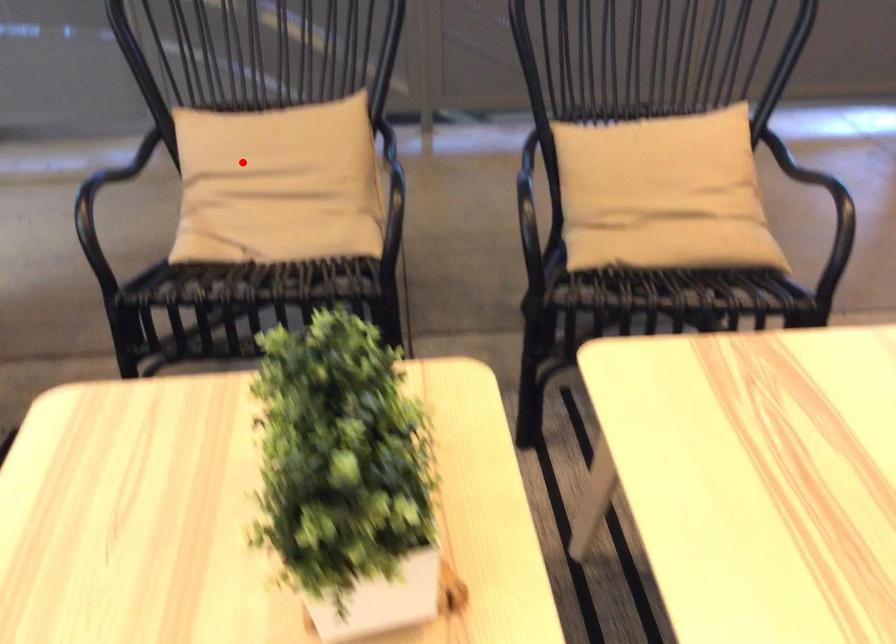
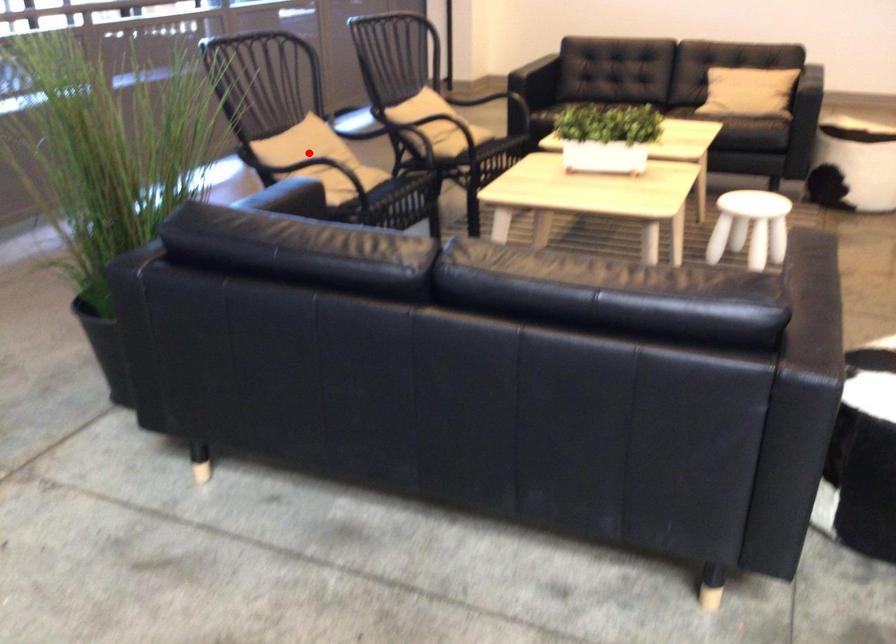
Based on the photo, I am providing you with two images of the same scene from different viewpoints. A red point is marked on the first image and another point is marked on the second image. Is the marked point in image1 the same physical position as the marked point in image2?

Yes